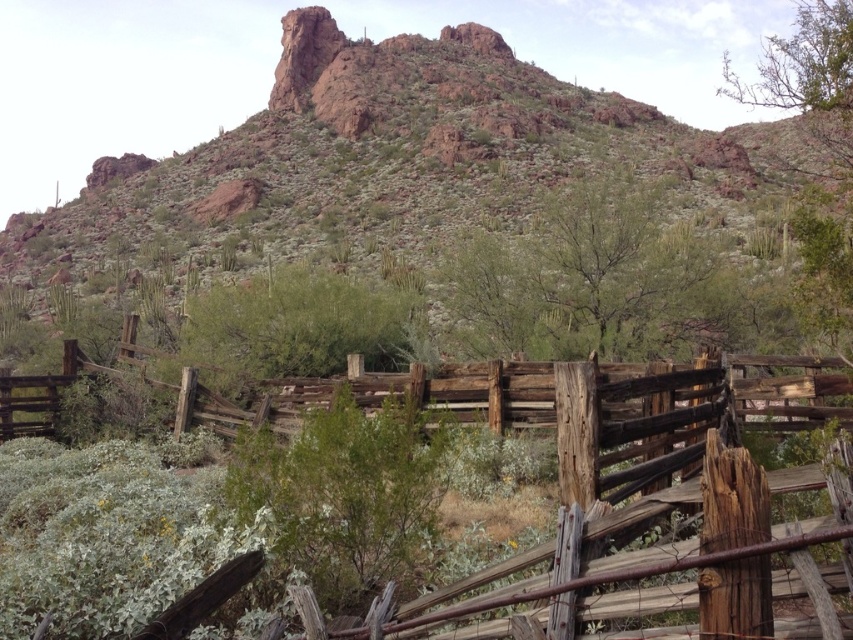
Question: Among these points, which one is nearest to the camera?

Choices:
 (A) (560, 285)
 (B) (57, 545)

Answer: (B)

Question: Which object is farther from the camera taking this photo?

Choices:
 (A) rusty rock formation at upper center
 (B) weathered wood fence at center

Answer: (A)

Question: Does rusty rock formation at upper center have a greater width compared to weathered wood fence at center?

Choices:
 (A) no
 (B) yes

Answer: (B)

Question: Is rusty rock formation at upper center bigger than weathered wood fence at center?

Choices:
 (A) no
 (B) yes

Answer: (B)

Question: Is rusty rock formation at upper center positioned at the back of weathered wood fence at center?

Choices:
 (A) no
 (B) yes

Answer: (B)

Question: Among these objects, which one is nearest to the camera?

Choices:
 (A) weathered wood fence at center
 (B) rusty rock formation at upper center

Answer: (A)